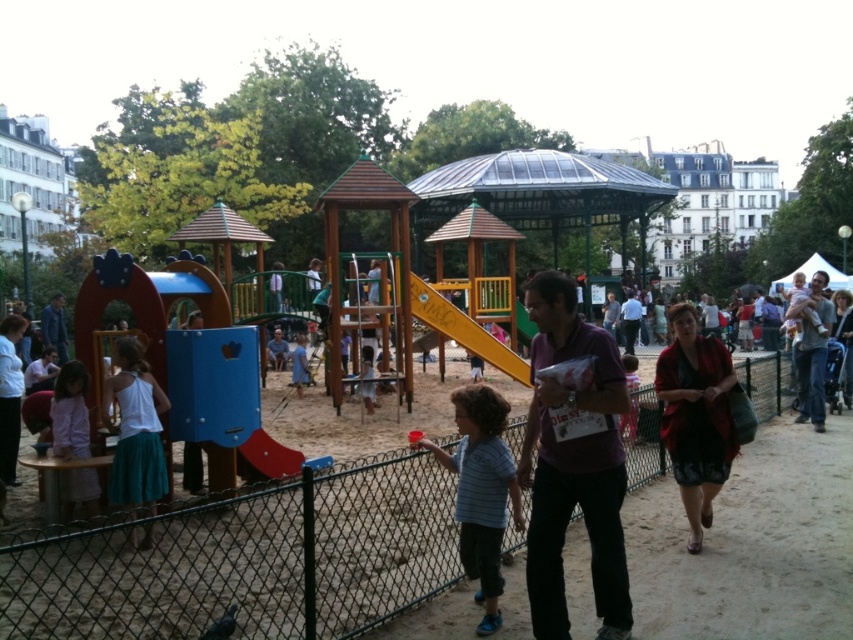
You are a photographer trying to capture a photo of the blue fabric jacket at left and the light blue shirt at center. Based on their positions, which one should you focus on first to ensure both are in frame?

The blue fabric jacket at left is located above the light blue shirt at center, so you should focus on the light blue shirt at center first to ensure both are in frame.

You are a photographer trying to capture a photo of the purple matte shirt at center and the blue striped shirt at center. Which one should you focus on first if you want to ensure both are in the frame without moving the camera?

You should focus on the purple matte shirt at center first because it is much taller than the blue striped shirt at center, ensuring it fits within the frame before adjusting for the shorter one.